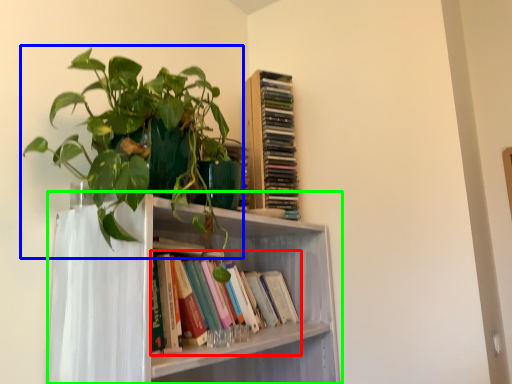
Question: Which object is the closest to the book (highlighted by a red box)? Choose among these: houseplant (highlighted by a blue box) or shelf (highlighted by a green box).

Choices:
 (A) houseplant
 (B) shelf

Answer: (B)